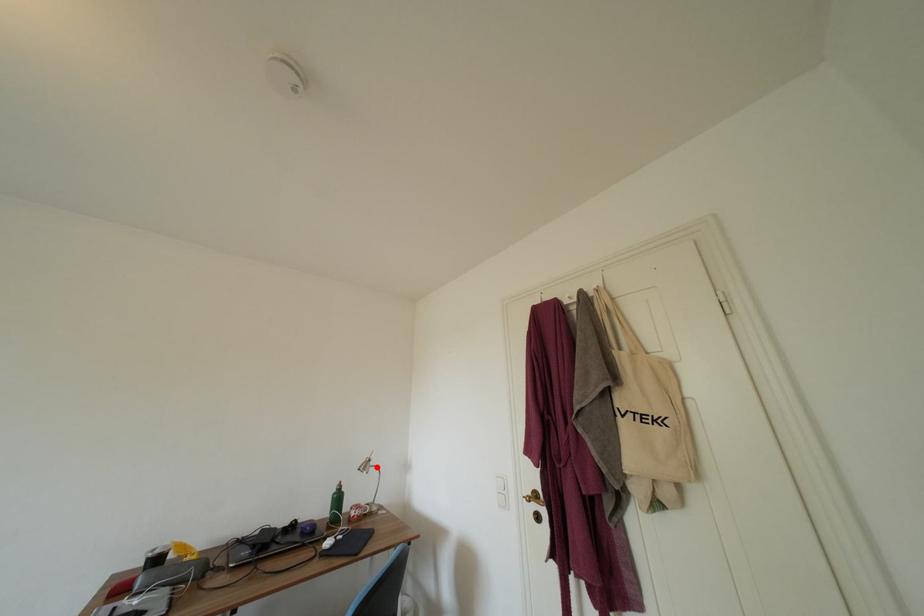
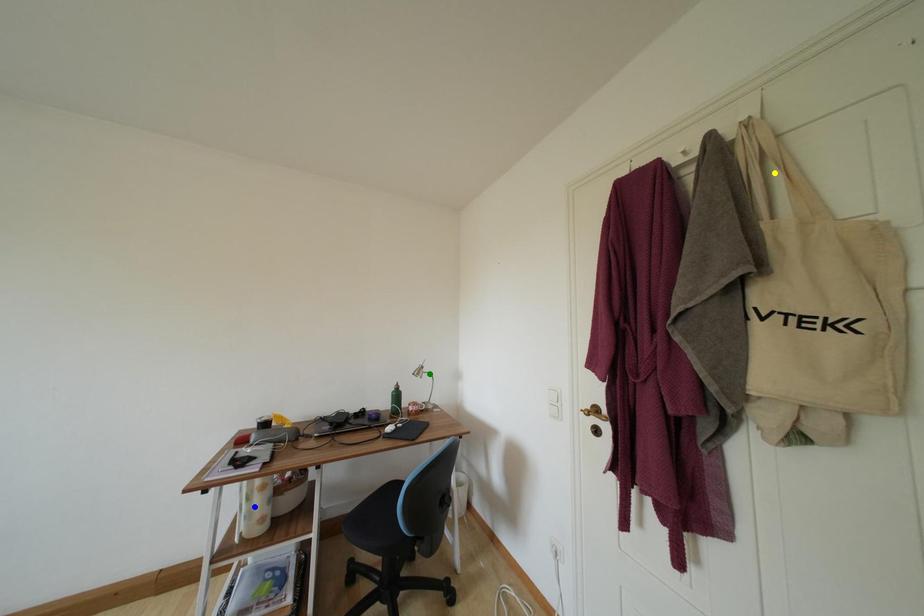
Question: I am providing you with two images of the same scene from different viewpoints. A red point is marked on the first image. You are given multiple points on the second image. In image 2, which mark is for the same physical point as the one in image 1?

Choices:
 (A) green point
 (B) yellow point
 (C) blue point

Answer: (A)